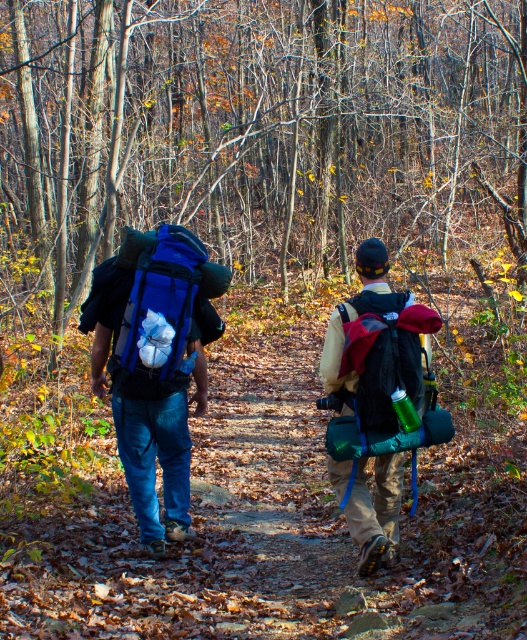
Between matte blue backpack at center and blue fabric backpack at left, which one is positioned lower?

Positioned lower is matte blue backpack at center.

Who is more distant from viewer, (357, 477) or (136, 280)?

The point (357, 477) is more distant.

The height and width of the screenshot is (640, 527). I want to click on matte blue backpack at center, so click(x=378, y=401).

Can you confirm if matte blue backpack at center is positioned below matte black backpack at center?

Yes.

Does point (409, 435) lie behind point (362, 321)?

That is True.

At what (x,y) coordinates should I click in order to perform the action: click on matte blue backpack at center. Please return your answer as a coordinate pair (x, y). Looking at the image, I should click on (378, 401).

Based on the photo, between blue fabric backpack at left and matte black backpack at center, which one has less height?

matte black backpack at center is shorter.

Can you confirm if blue fabric backpack at left is wider than matte black backpack at center?

Indeed, blue fabric backpack at left has a greater width compared to matte black backpack at center.

Between point (177, 321) and point (374, 342), which one is positioned in front?

Positioned in front is point (374, 342).

At what (x,y) coordinates should I click in order to perform the action: click on blue fabric backpack at left. Please return your answer as a coordinate pair (x, y). Image resolution: width=527 pixels, height=640 pixels. Looking at the image, I should click on (159, 316).